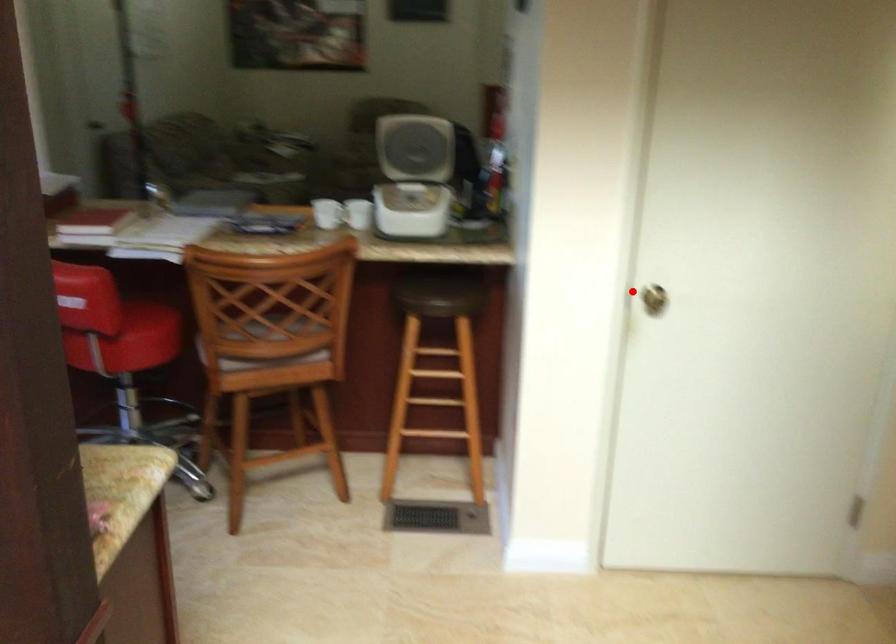
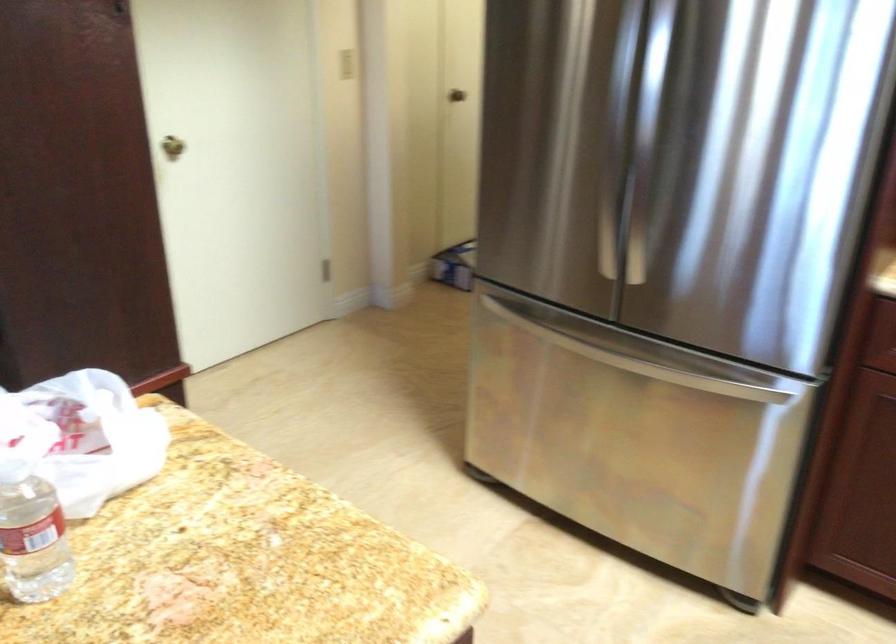
Question: I am providing you with two images of the same scene from different viewpoints. Given a red point in image1, look at the same physical point in image2. Is it:

Choices:
 (A) Closer to the viewpoint
 (B) Farther from the viewpoint

Answer: (B)